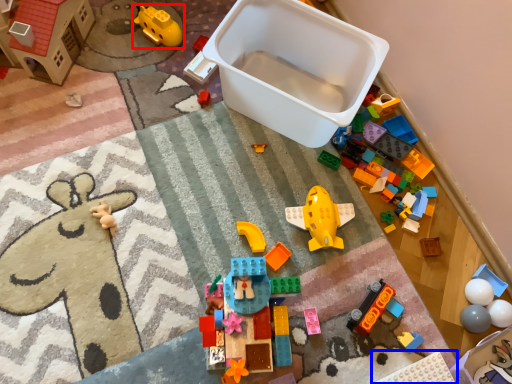
Question: Which object is further to the camera taking this photo, toy (highlighted by a red box) or toy (highlighted by a blue box)?

Choices:
 (A) toy
 (B) toy

Answer: (A)